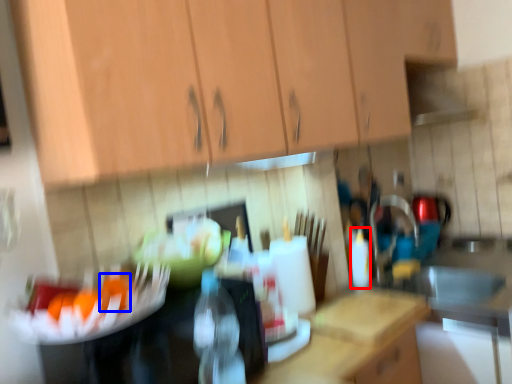
Question: Which object appears farthest to the camera in this image, bottle (highlighted by a red box) or food (highlighted by a blue box)?

Choices:
 (A) bottle
 (B) food

Answer: (A)